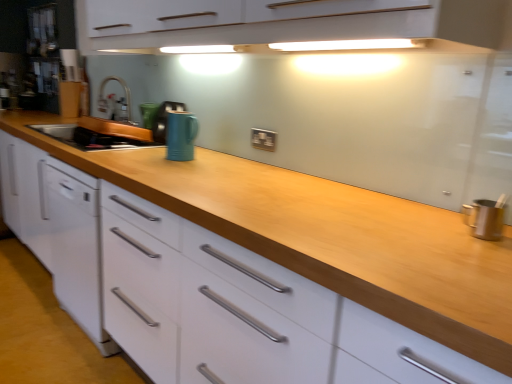
Question: From the image's perspective, is matte blue mug at center, which is the third appliance in back-to-front order, located above black plastic electric outlet at center?

Choices:
 (A) no
 (B) yes

Answer: (B)

Question: Would you say black plastic electric outlet at center is part of matte blue mug at center, which is the third appliance in back-to-front order,'s contents?

Choices:
 (A) yes
 (B) no

Answer: (B)

Question: Is matte blue mug at center, which is the third appliance in back-to-front order, thinner than black plastic electric outlet at center?

Choices:
 (A) no
 (B) yes

Answer: (A)

Question: Is matte blue mug at center, which is the third appliance in back-to-front order, not within black plastic electric outlet at center?

Choices:
 (A) yes
 (B) no

Answer: (A)

Question: Is matte blue mug at center, positioned as the first appliance in front-to-back order, oriented away from black plastic electric outlet at center?

Choices:
 (A) yes
 (B) no

Answer: (B)

Question: Is matte blue mug at center, which is the third appliance in back-to-front order, to the left of black plastic electric outlet at center from the viewer's perspective?

Choices:
 (A) yes
 (B) no

Answer: (A)

Question: Is satin nickel faucet at center wider than matte blue mug at center, which is the third appliance in back-to-front order?

Choices:
 (A) yes
 (B) no

Answer: (A)

Question: From the image's perspective, is satin nickel faucet at center below matte blue mug at center, positioned as the first appliance in front-to-back order?

Choices:
 (A) no
 (B) yes

Answer: (A)

Question: Can you confirm if satin nickel faucet at center is taller than matte blue mug at center, which is the third appliance in back-to-front order?

Choices:
 (A) no
 (B) yes

Answer: (B)

Question: Does satin nickel faucet at center have a lesser height compared to matte blue mug at center, positioned as the first appliance in front-to-back order?

Choices:
 (A) yes
 (B) no

Answer: (B)

Question: Is matte blue mug at center, which is the third appliance in back-to-front order, at the back of satin nickel faucet at center?

Choices:
 (A) no
 (B) yes

Answer: (A)

Question: From the image's perspective, is satin nickel faucet at center over matte blue mug at center, which is the third appliance in back-to-front order?

Choices:
 (A) yes
 (B) no

Answer: (A)

Question: Does satin nickel faucet at center have a smaller size compared to glossy ceramic mug at center, which is counted as the second appliance, starting from the back?

Choices:
 (A) no
 (B) yes

Answer: (A)